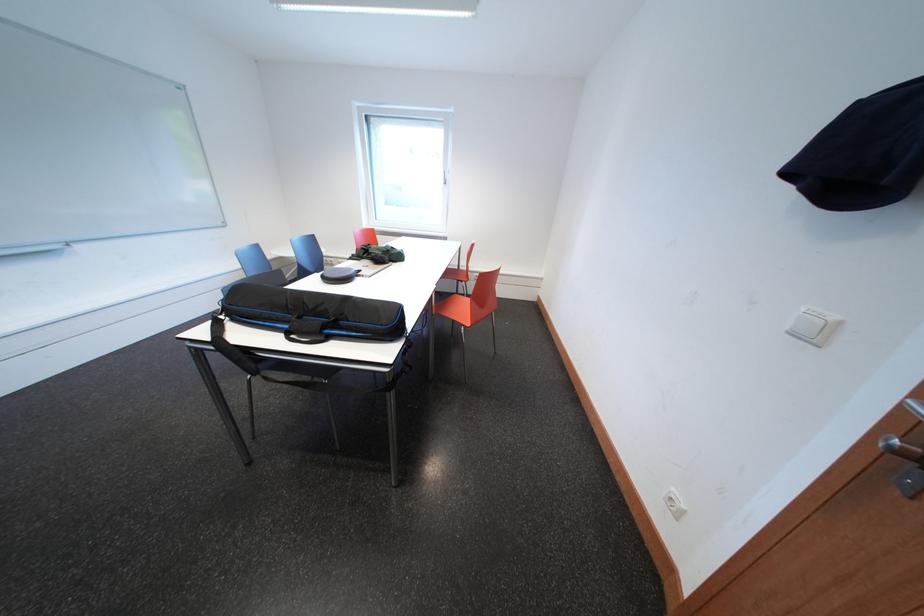
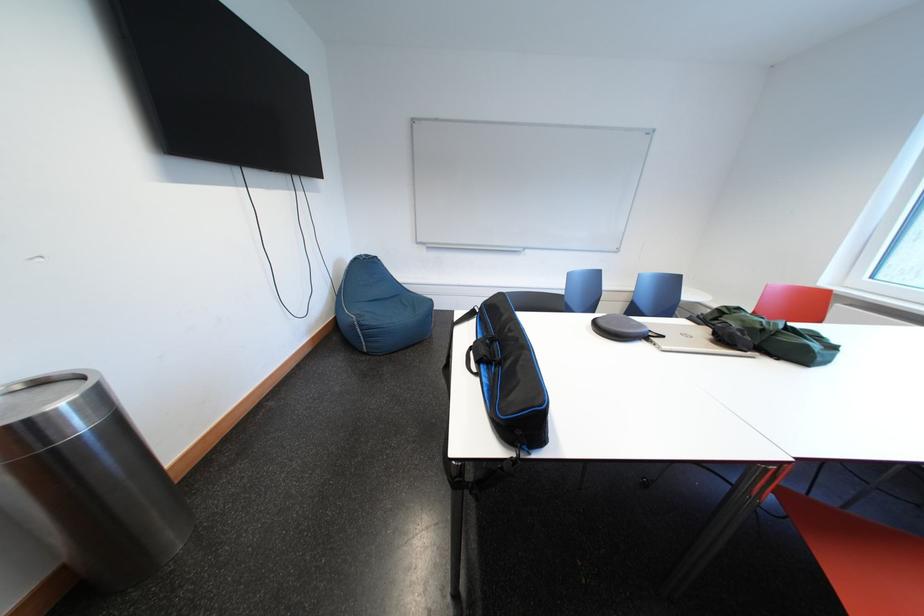
In the second image, find the point that corresponds to (335,336) in the first image.

(492, 371)